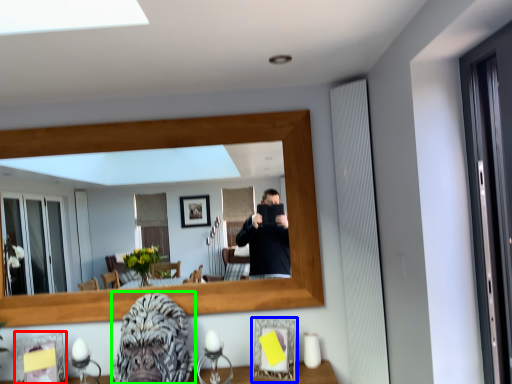
Question: Considering the real-world distances, which object is closest to picture frame (highlighted by a red box)? picture frame (highlighted by a blue box) or gorilla (highlighted by a green box).

Choices:
 (A) picture frame
 (B) gorilla

Answer: (B)